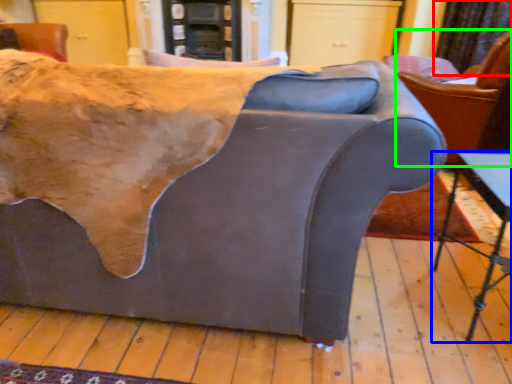
Question: Estimate the real-world distances between objects in this image. Which object is farther from curtain (highlighted by a red box), table (highlighted by a blue box) or chair (highlighted by a green box)?

Choices:
 (A) table
 (B) chair

Answer: (A)